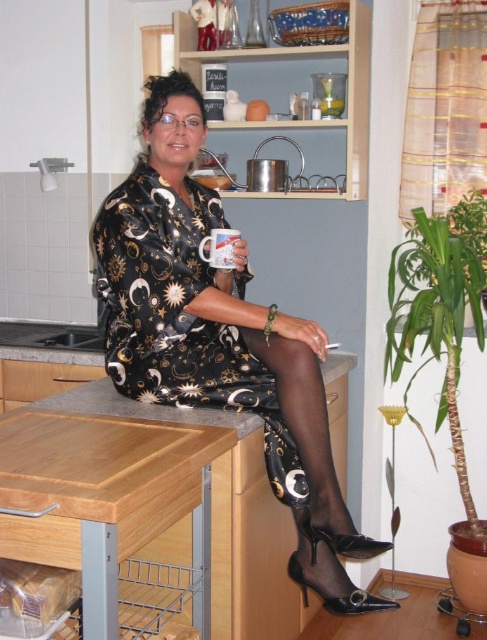
Does point (187, 113) come farther from viewer compared to point (231, 268)?

That is False.

Who is shorter, metallic dress at center or white ceramic mug at center?

Standing shorter between the two is white ceramic mug at center.

Is point (152, 209) closer to viewer compared to point (208, 248)?

Yes, point (152, 209) is closer to viewer.

Locate an element on the screen. The width and height of the screenshot is (487, 640). metallic dress at center is located at coordinates (220, 337).